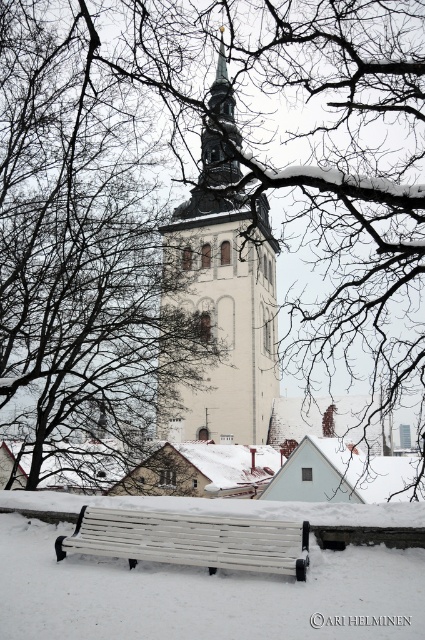
Is gray stone tower at center smaller than white wooden bench at lower center?

No.

Between gray stone tower at center and white wooden bench at lower center, which one is positioned lower?

white wooden bench at lower center is lower down.

Is point (260, 204) farther from camera compared to point (161, 532)?

Yes.

Locate an element on the screen. The image size is (425, 640). gray stone tower at center is located at coordinates (221, 296).